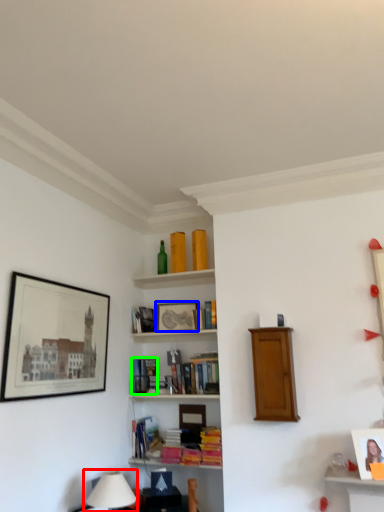
Question: Which object is positioned farthest from table lamp (highlighted by a red box)? Select from picture frame (highlighted by a blue box) and book (highlighted by a green box).

Choices:
 (A) picture frame
 (B) book

Answer: (A)